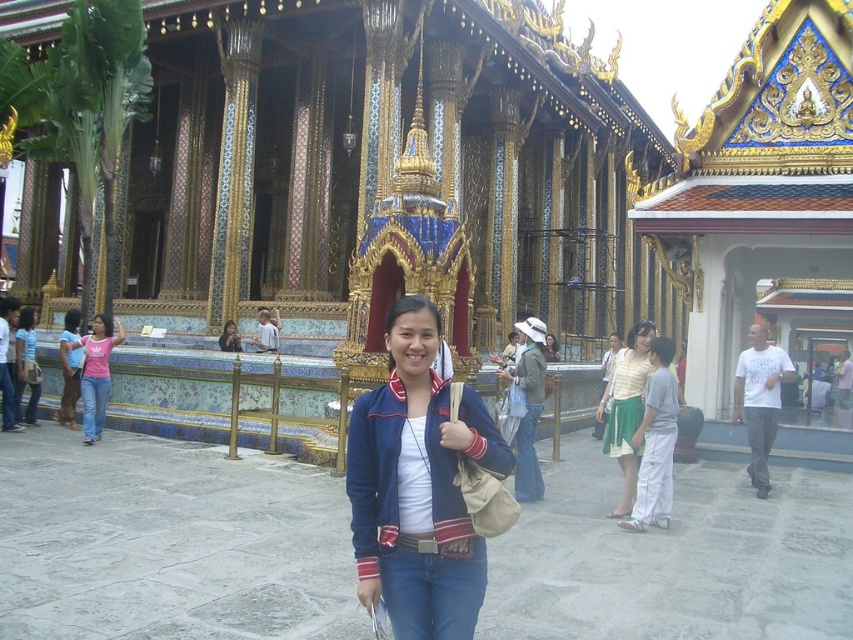
Is gold/gilded wood palace at center shorter than pink cotton shirt at center?

Incorrect, gold/gilded wood palace at center's height does not fall short of pink cotton shirt at center's.

Between gold/gilded wood palace at center and pink cotton shirt at center, which one is positioned lower?

pink cotton shirt at center

Does point (578, 244) lie in front of point (82, 404)?

No, it is behind (82, 404).

Find the location of `gold/gilded wood palace at center`. gold/gilded wood palace at center is located at coordinates (480, 180).

Which of these two, navy blue jacket at center or striped cotton dress at center, stands taller?

Standing taller between the two is navy blue jacket at center.

Does navy blue jacket at center have a lesser height compared to striped cotton dress at center?

No, navy blue jacket at center is not shorter than striped cotton dress at center.

The width and height of the screenshot is (853, 640). In order to click on navy blue jacket at center in this screenshot , I will do `click(418, 486)`.

Can you confirm if navy blue jacket at center is taller than pink cotton shirt at center?

Indeed, navy blue jacket at center has a greater height compared to pink cotton shirt at center.

Between point (393, 321) and point (86, 388), which one is positioned behind?

Positioned behind is point (86, 388).

Find the location of a particular element. This screenshot has width=853, height=640. navy blue jacket at center is located at coordinates (418, 486).